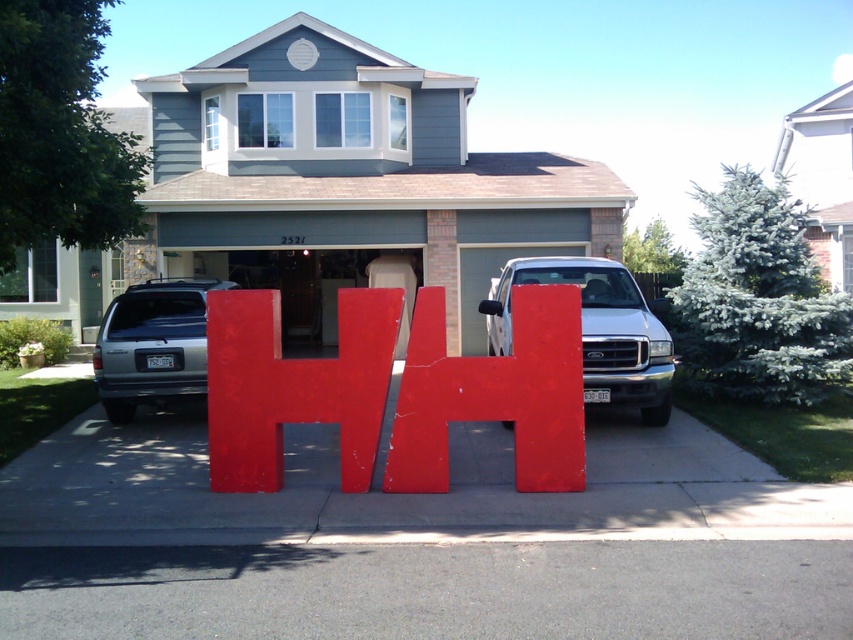
You are a delivery person trying to park your 2.5 meter wide delivery van between the gray asphalt at center and the smooth concrete driveway at center. Can you fit your van there?

The gray asphalt at center and smooth concrete driveway at center are 2.66 meters apart from each other. Since your van is 2.5 meters wide, it can fit between them with some space to spare.

You are a delivery driver who needs to park your truck between the gray asphalt at center and the silver metallic suv at center. The truck requires a minimum of 6 meters of space. Can you fit it there?

The gray asphalt at center is 6.45 meters from the silver metallic suv at center, so yes, the truck can fit between them since the distance is greater than the required 6 meters.

You are a delivery driver who needs to park your delivery van between the gray siding garage at center and the white glossy truck at center. Is there enough space between them for your van?

The gray siding garage at center is located above the white glossy truck at center, meaning they are vertically aligned rather than side by side. Therefore, there is no horizontal space between them for the delivery van to park.